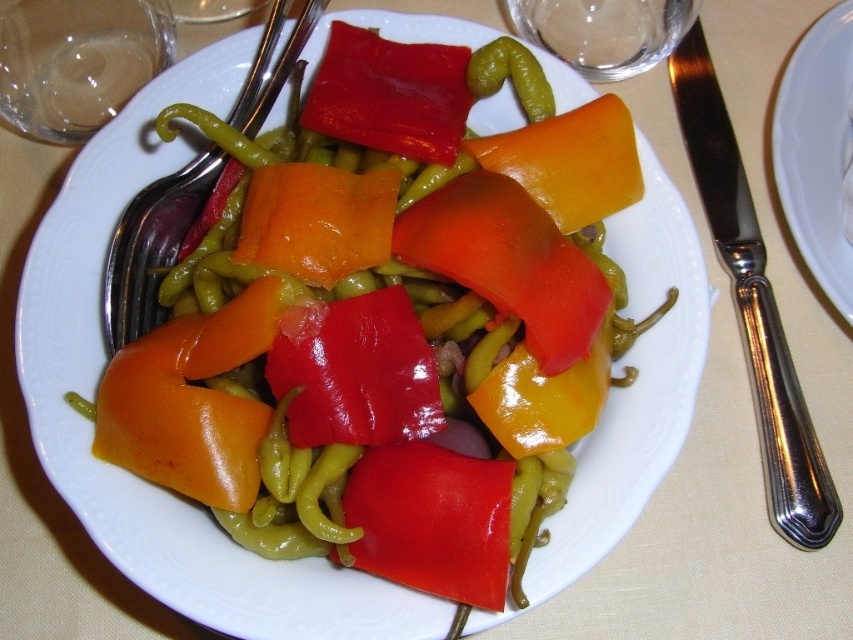
Is shiny plastic peppers at center thinner than yellow matte carrot at center?

No.

Which is in front, point (595, 298) or point (467, 150)?

Point (595, 298) is in front.

This screenshot has height=640, width=853. I want to click on shiny plastic peppers at center, so click(x=381, y=346).

Identify the location of shiny plastic peppers at center. The width and height of the screenshot is (853, 640). (381, 346).

Does shiny plastic peppers at center have a lesser width compared to glossy orange carrot at center?

Incorrect, shiny plastic peppers at center's width is not less than glossy orange carrot at center's.

Is point (289, 435) closer to camera compared to point (288, 240)?

Yes, it is in front of point (288, 240).

Image resolution: width=853 pixels, height=640 pixels. I want to click on shiny plastic peppers at center, so click(381, 346).

Who is higher up, shiny plastic peppers at center or silver metallic knife at upper right?

silver metallic knife at upper right is above.

The image size is (853, 640). What do you see at coordinates (381, 346) in the screenshot?
I see `shiny plastic peppers at center` at bounding box center [381, 346].

What are the coordinates of `shiny plastic peppers at center` in the screenshot? It's located at (381, 346).